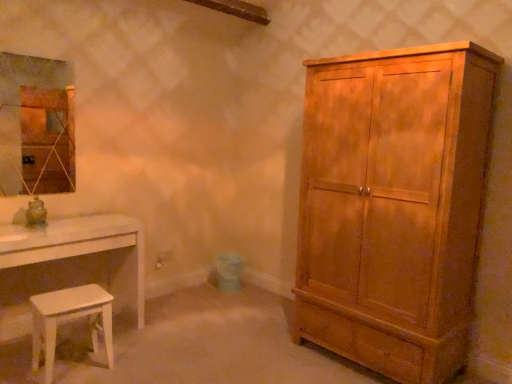
Question: Considering the relative sizes of white glossy stool at lower left and matte wood cabinet at right in the image provided, is white glossy stool at lower left bigger than matte wood cabinet at right?

Choices:
 (A) no
 (B) yes

Answer: (A)

Question: Can you confirm if white glossy stool at lower left is wider than matte wood cabinet at right?

Choices:
 (A) no
 (B) yes

Answer: (A)

Question: Is white glossy stool at lower left not inside matte wood cabinet at right?

Choices:
 (A) yes
 (B) no

Answer: (A)

Question: Considering the relative sizes of white glossy stool at lower left and matte wood cabinet at right in the image provided, is white glossy stool at lower left thinner than matte wood cabinet at right?

Choices:
 (A) no
 (B) yes

Answer: (B)

Question: From a real-world perspective, is white glossy stool at lower left physically above matte wood cabinet at right?

Choices:
 (A) yes
 (B) no

Answer: (B)

Question: Is white glossy stool at lower left with matte wood cabinet at right?

Choices:
 (A) no
 (B) yes

Answer: (A)

Question: From the image's perspective, is white glossy table at lower left on matte glass mirror at upper left?

Choices:
 (A) yes
 (B) no

Answer: (B)

Question: Is white glossy table at lower left positioned with its back to matte glass mirror at upper left?

Choices:
 (A) no
 (B) yes

Answer: (A)

Question: Can you confirm if white glossy table at lower left is wider than matte glass mirror at upper left?

Choices:
 (A) no
 (B) yes

Answer: (B)

Question: Is white glossy table at lower left bigger than matte glass mirror at upper left?

Choices:
 (A) yes
 (B) no

Answer: (A)

Question: From the image's perspective, would you say white glossy table at lower left is shown under matte glass mirror at upper left?

Choices:
 (A) no
 (B) yes

Answer: (B)

Question: From a real-world perspective, is white glossy table at lower left over matte glass mirror at upper left?

Choices:
 (A) yes
 (B) no

Answer: (B)

Question: Are white glossy table at lower left and white glossy stool at lower left located far from each other?

Choices:
 (A) yes
 (B) no

Answer: (B)